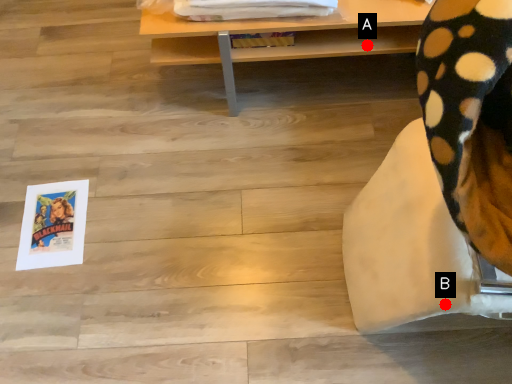
Question: Two points are circled on the image, labeled by A and B beside each circle. Which point is closer to the camera?

Choices:
 (A) A is closer
 (B) B is closer

Answer: (B)